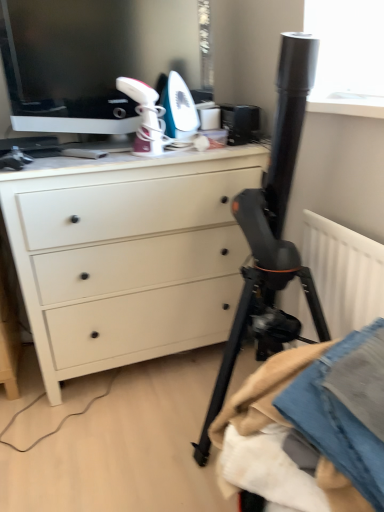
Question: From the image's perspective, does white matte chest of drawers at center appear lower than denim fabric at lower right?

Choices:
 (A) yes
 (B) no

Answer: (B)

Question: Is white matte chest of drawers at center completely or partially outside of denim fabric at lower right?

Choices:
 (A) no
 (B) yes

Answer: (B)

Question: Is white matte chest of drawers at center positioned with its back to denim fabric at lower right?

Choices:
 (A) no
 (B) yes

Answer: (A)

Question: Can you confirm if white matte chest of drawers at center is smaller than denim fabric at lower right?

Choices:
 (A) yes
 (B) no

Answer: (B)

Question: Could denim fabric at lower right be considered to be inside white matte chest of drawers at center?

Choices:
 (A) no
 (B) yes

Answer: (A)

Question: From the image's perspective, does white matte chest of drawers at center appear higher than denim fabric at lower right?

Choices:
 (A) yes
 (B) no

Answer: (A)

Question: Are denim fabric at lower right and matte black monitor at upper left located far from each other?

Choices:
 (A) yes
 (B) no

Answer: (A)

Question: Is denim fabric at lower right at the right side of matte black monitor at upper left?

Choices:
 (A) no
 (B) yes

Answer: (B)

Question: From a real-world perspective, is denim fabric at lower right beneath matte black monitor at upper left?

Choices:
 (A) no
 (B) yes

Answer: (B)

Question: Does denim fabric at lower right have a greater height compared to matte black monitor at upper left?

Choices:
 (A) yes
 (B) no

Answer: (B)

Question: Can matte black monitor at upper left be found inside denim fabric at lower right?

Choices:
 (A) no
 (B) yes

Answer: (A)

Question: From the image's perspective, is denim fabric at lower right on matte black monitor at upper left?

Choices:
 (A) yes
 (B) no

Answer: (B)

Question: From the image's perspective, is matte black monitor at upper left below denim fabric at lower right?

Choices:
 (A) no
 (B) yes

Answer: (A)